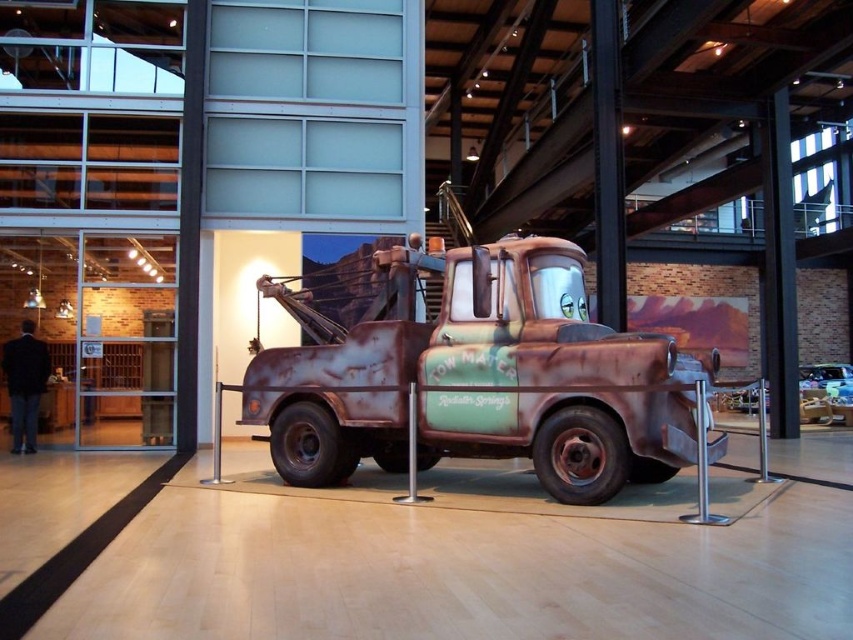
Is rusty metal tow truck at center thinner than shiny silver car at center?

No, rusty metal tow truck at center is not thinner than shiny silver car at center.

Is point (338, 449) positioned in front of point (839, 390)?

That is True.

Is point (332, 385) in front of point (820, 369)?

That is True.

Locate an element on the screen. rusty metal tow truck at center is located at coordinates (479, 378).